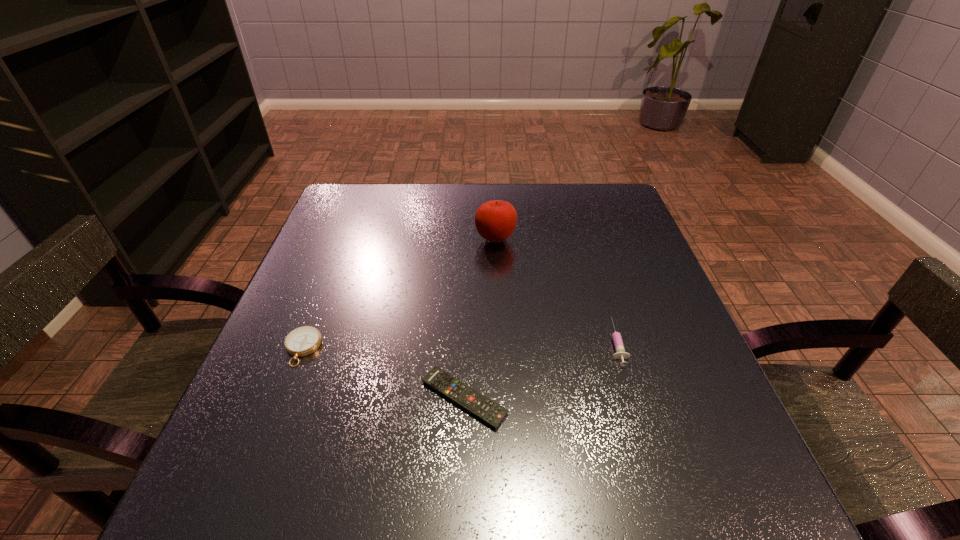
This screenshot has height=540, width=960. Identify the location of free area in between the rightmost object and the shortest object. (540, 370).

This screenshot has height=540, width=960. I want to click on the third closest object to the third shortest object, so click(304, 340).

You are a GUI agent. You are given a task and a screenshot of the screen. Output one action in this format:
    pyautogui.click(x=<x>, y=<y>)
    Task: Click on the object that is the closest to the remote control
    The width and height of the screenshot is (960, 540).
    Given the screenshot: What is the action you would take?
    click(x=620, y=353)

You are a GUI agent. You are given a task and a screenshot of the screen. Output one action in this format:
    pyautogui.click(x=<x>, y=<y>)
    Task: Click on the free location that satisfies the following two spatial constraints: 1. on the back side of the compass; 2. on the left side of the syringe
    This screenshot has width=960, height=540.
    Given the screenshot: What is the action you would take?
    point(304,343)

Identify the location of vacant area in the image that satisfies the following two spatial constraints: 1. on the back side of the third shortest object; 2. on the right side of the remote control. (466, 343).